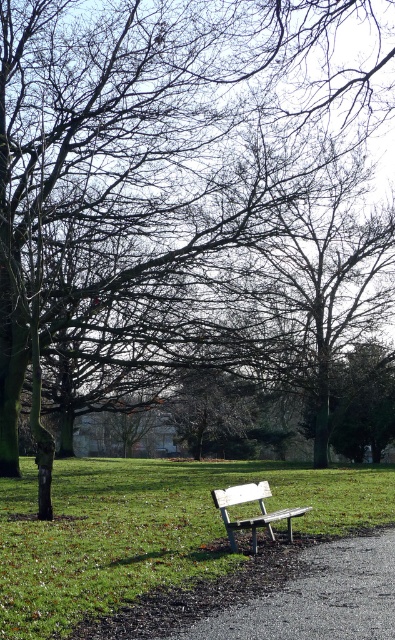
Is green grass at center wider than gravel path at center?

Correct, the width of green grass at center exceeds that of gravel path at center.

Find the location of a particular element. Image resolution: width=395 pixels, height=640 pixels. green grass at center is located at coordinates (146, 529).

At what (x,y) coordinates should I click in order to perform the action: click on green grass at center. Please return your answer as a coordinate pair (x, y). This screenshot has width=395, height=640. Looking at the image, I should click on (146, 529).

Does green grass at center have a greater width compared to white plastic bench at center?

Yes, green grass at center is wider than white plastic bench at center.

Between point (63, 531) and point (235, 548), which one is positioned in front?

Point (235, 548) is more forward.

Where is `green grass at center`? This screenshot has width=395, height=640. green grass at center is located at coordinates (146, 529).

Who is higher up, gravel path at center or white plastic bench at center?

white plastic bench at center is higher up.

Does gravel path at center lie behind white plastic bench at center?

No, it is in front of white plastic bench at center.

Where is `gravel path at center`? The image size is (395, 640). gravel path at center is located at coordinates (314, 596).

The width and height of the screenshot is (395, 640). I want to click on gravel path at center, so click(x=314, y=596).